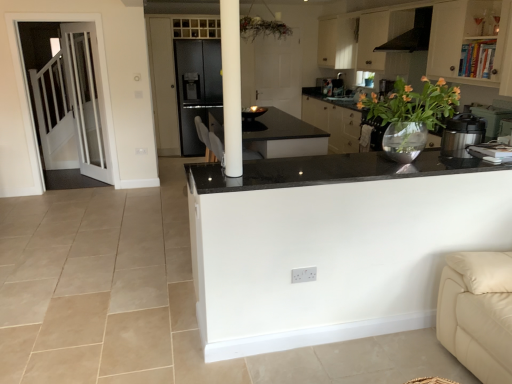
Question: From the image's perspective, relative to metallic silver pressure cooker at right, is white matte cabinet at upper right above or below?

Choices:
 (A) below
 (B) above

Answer: (B)

Question: Is point (449, 18) closer or farther from the camera than point (461, 139)?

Choices:
 (A) closer
 (B) farther

Answer: (B)

Question: Which object is positioned farthest from the metallic silver pressure cooker at right?

Choices:
 (A) black matte exhaust hood at upper right
 (B) white glass door at left
 (C) translucent glass vase at upper right
 (D) black granite countertop at center
 (E) white matte cabinet at upper right

Answer: (B)

Question: Estimate the real-world distances between objects in this image. Which object is closer to the translucent glass vase at upper right?

Choices:
 (A) white glass door at left
 (B) black matte exhaust hood at upper right
 (C) white matte cabinet at upper right
 (D) black granite countertop at center
 (E) metallic silver pressure cooker at right

Answer: (E)